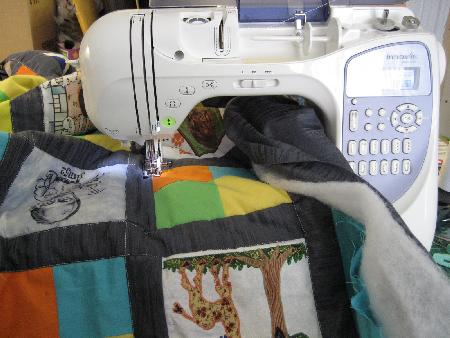
The height and width of the screenshot is (338, 450). In order to click on inside of blanket in this screenshot , I will do `click(394, 283)`.